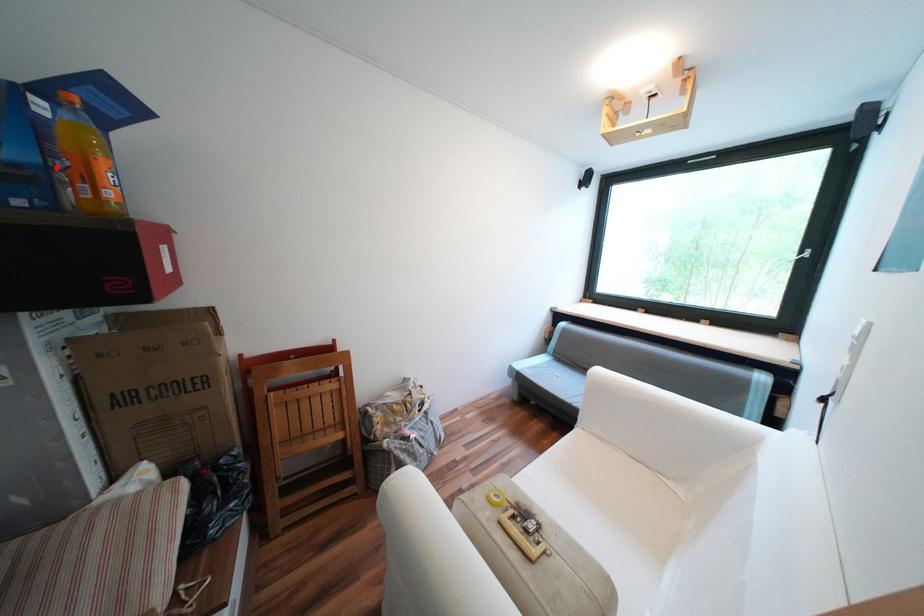
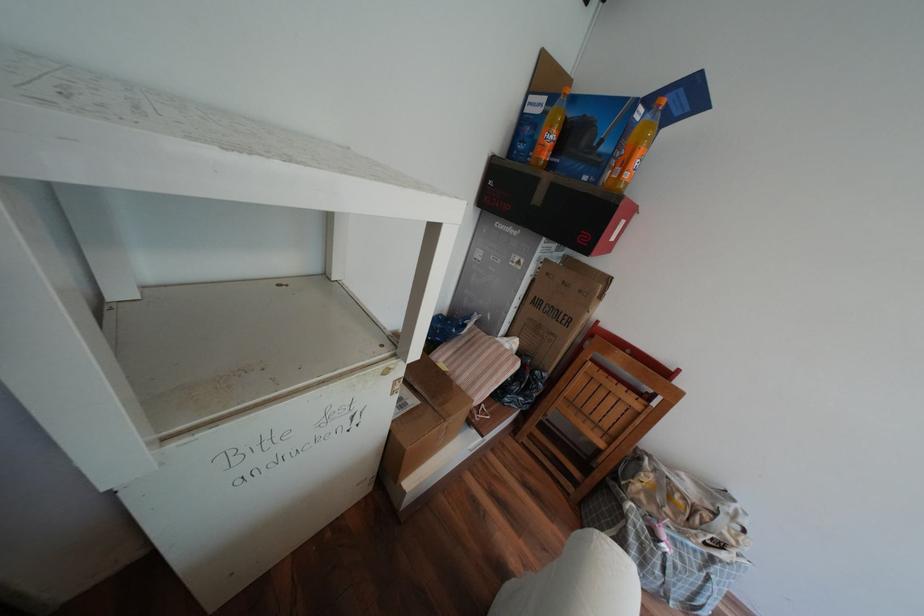
The point at the highlighted location is marked in the first image. Where is the corresponding point in the second image?

(621, 156)